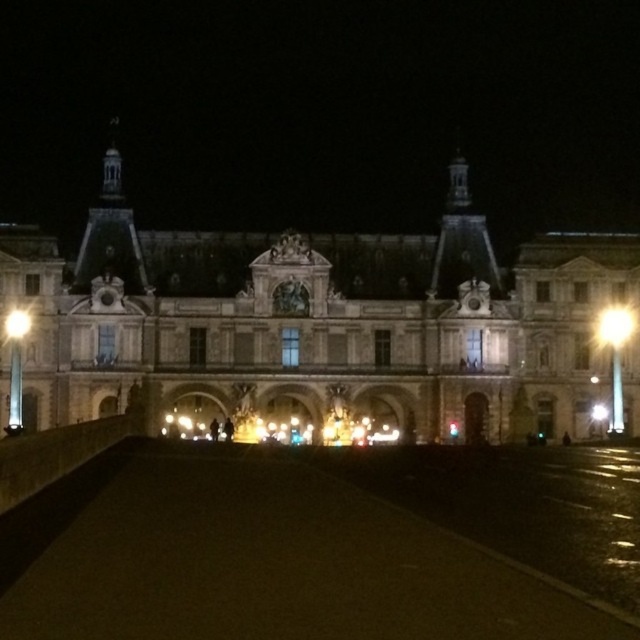
Between bright yellow light at upper right and matte white light at left, which one is positioned lower?

matte white light at left

Can you confirm if bright yellow light at upper right is shorter than matte white light at left?

In fact, bright yellow light at upper right may be taller than matte white light at left.

Does point (604, 342) lie in front of point (19, 321)?

No, (604, 342) is further to viewer.

Identify the location of bright yellow light at upper right. The image size is (640, 640). (614, 324).